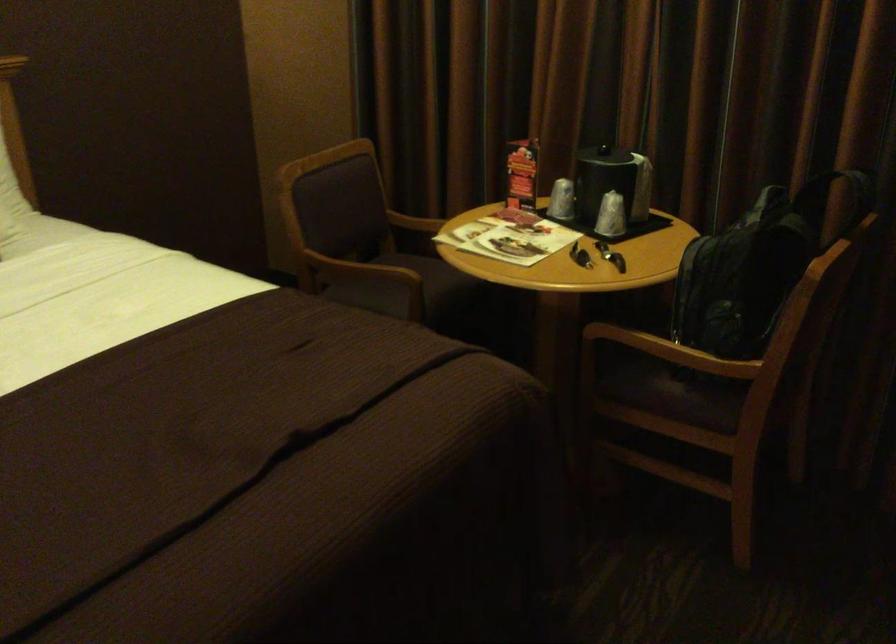
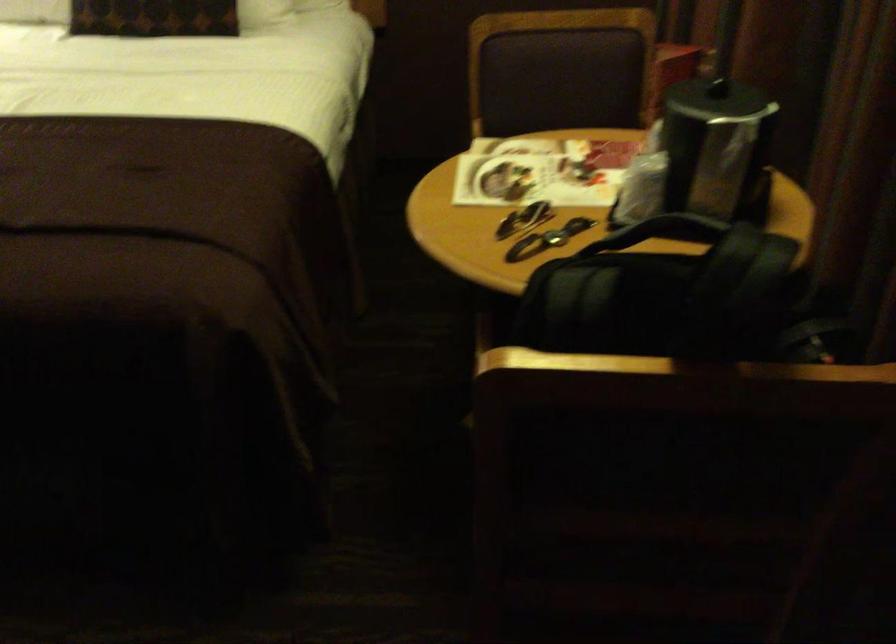
Locate, in the second image, the point that corresponds to (x=640, y=180) in the first image.

(717, 149)